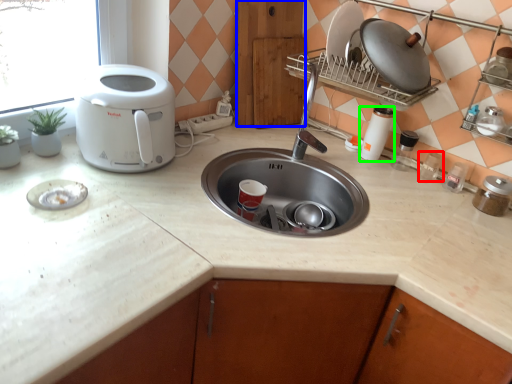
Question: Which object is positioned closest to appliance (highlighted by a red box)? Select from cabinetry (highlighted by a blue box) and appliance (highlighted by a green box).

Choices:
 (A) cabinetry
 (B) appliance

Answer: (B)